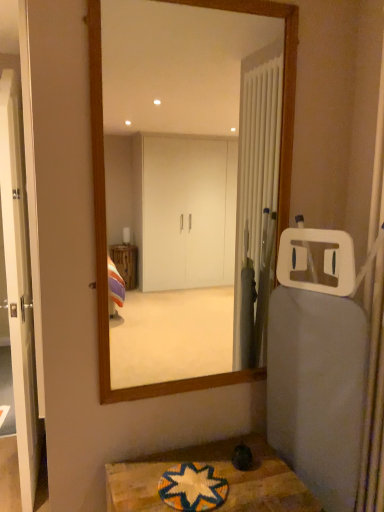
Question: Would you say multicolored woven mat at lower center is inside or outside wooden textured table at lower center?

Choices:
 (A) outside
 (B) inside

Answer: (B)

Question: Would you say multicolored woven mat at lower center is to the left or to the right of wooden textured table at lower center in the picture?

Choices:
 (A) left
 (B) right

Answer: (A)

Question: Estimate the real-world distances between objects in this image. Which object is closer to the wooden framed mirror at center?

Choices:
 (A) multicolored woven mat at lower center
 (B) white glossy door at left
 (C) wooden textured table at lower center

Answer: (B)

Question: Estimate the real-world distances between objects in this image. Which object is closer to the white glossy door at left?

Choices:
 (A) multicolored woven mat at lower center
 (B) wooden textured table at lower center
 (C) wooden framed mirror at center

Answer: (B)